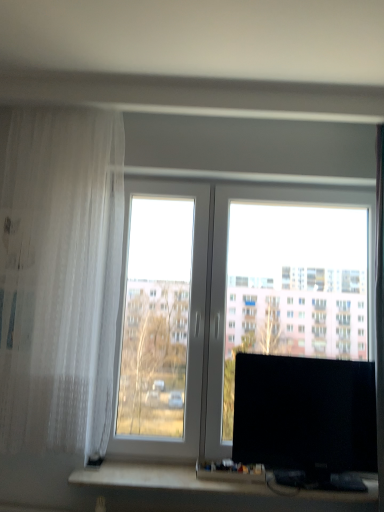
Image resolution: width=384 pixels, height=512 pixels. Identify the location of empty space that is ontop of transparent glass window at center. (243, 179).